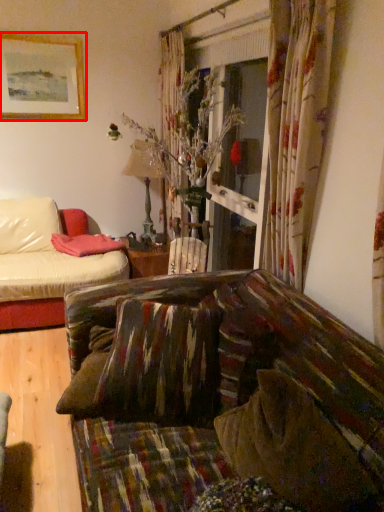
Question: From the image's perspective, what is the correct spatial relationship of picture frame (annotated by the red box) in relation to pillow?

Choices:
 (A) above
 (B) below

Answer: (A)